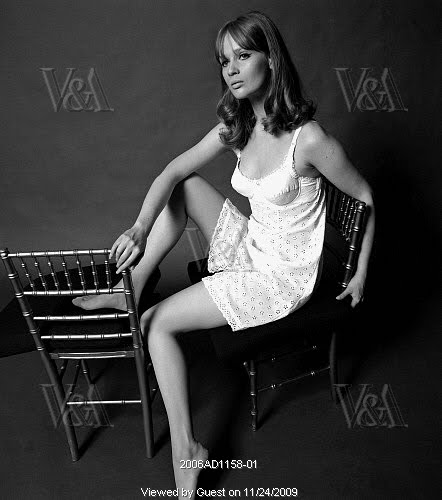
The height and width of the screenshot is (500, 442). Find the location of `legs of chair`. legs of chair is located at coordinates (82, 369), (52, 379), (142, 390), (251, 383), (333, 354).